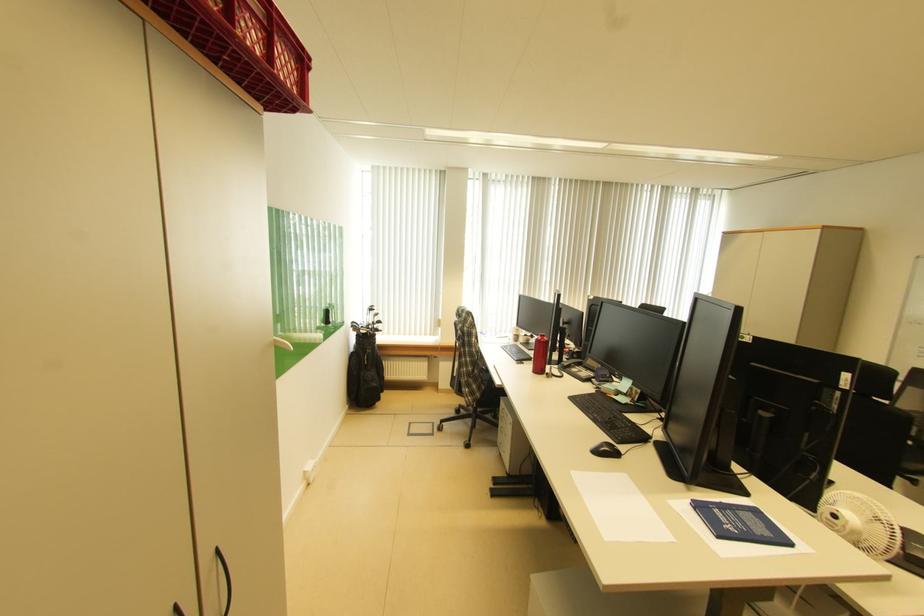
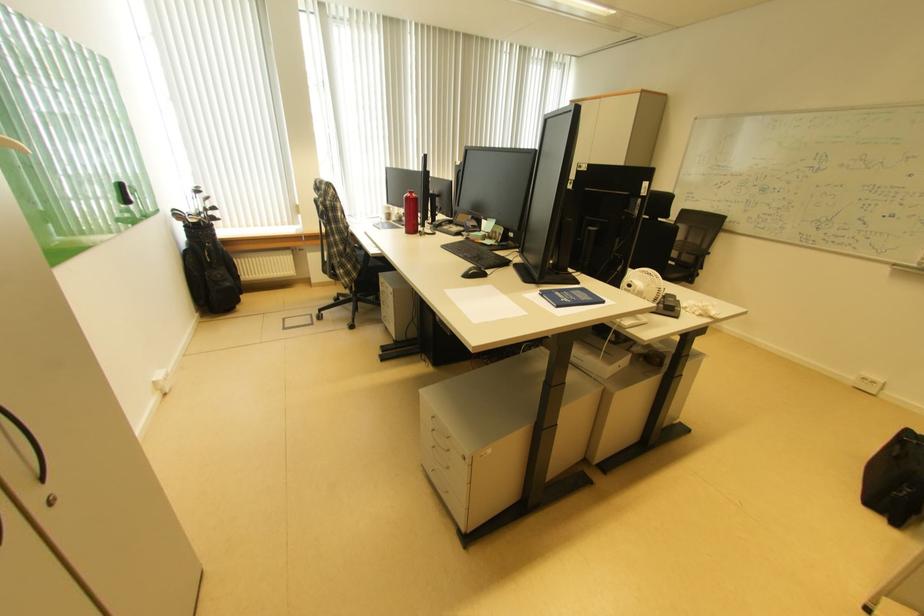
In the second image, find the point that corresponds to the point at 608,453 in the first image.

(477, 277)